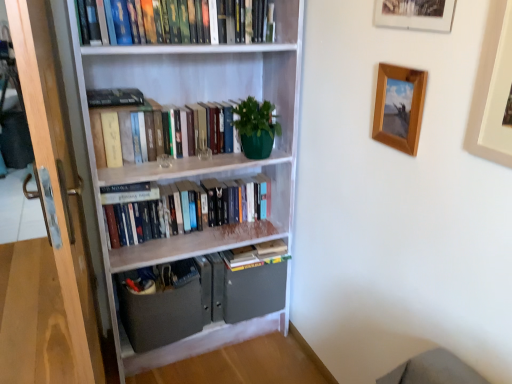
Question: Is matte gray cabinet at lower center thinner than hardcover books at upper center, the 4th book ordered from the bottom?

Choices:
 (A) no
 (B) yes

Answer: (A)

Question: Is matte gray cabinet at lower center far from hardcover books at upper center, the 4th book ordered from the bottom?

Choices:
 (A) no
 (B) yes

Answer: (B)

Question: Considering the relative sizes of matte gray cabinet at lower center and hardcover books at upper center, the 4th book ordered from the bottom, in the image provided, is matte gray cabinet at lower center wider than hardcover books at upper center, the 4th book ordered from the bottom,?

Choices:
 (A) no
 (B) yes

Answer: (B)

Question: From the image's perspective, is matte gray cabinet at lower center on top of hardcover books at upper center, the 4th book ordered from the bottom?

Choices:
 (A) yes
 (B) no

Answer: (B)

Question: From a real-world perspective, does matte gray cabinet at lower center sit lower than hardcover books at upper center, which is counted as the first book, starting from the top?

Choices:
 (A) no
 (B) yes

Answer: (B)

Question: Considering the positions of wooden picture frame at upper center, the 2th picture frame when ordered from left to right, and hardcover books at upper center, which is counted as the first book, starting from the top, in the image, is wooden picture frame at upper center, the 2th picture frame when ordered from left to right, taller or shorter than hardcover books at upper center, which is counted as the first book, starting from the top,?

Choices:
 (A) tall
 (B) short

Answer: (A)

Question: Relative to hardcover books at upper center, the 4th book ordered from the bottom, is wooden picture frame at upper center, the second picture frame viewed from the right, in front or behind?

Choices:
 (A) front
 (B) behind

Answer: (A)

Question: In terms of size, does wooden picture frame at upper center, the 2th picture frame when ordered from left to right, appear bigger or smaller than hardcover books at upper center, the 4th book ordered from the bottom?

Choices:
 (A) big
 (B) small

Answer: (B)

Question: Considering the positions of wooden picture frame at upper center, the 2th picture frame when ordered from left to right, and hardcover books at upper center, which is counted as the first book, starting from the top, in the image, is wooden picture frame at upper center, the 2th picture frame when ordered from left to right, wider or thinner than hardcover books at upper center, which is counted as the first book, starting from the top,?

Choices:
 (A) thin
 (B) wide

Answer: (A)

Question: Considering the relative positions of wooden picture frame at upper right, placed as the 1th picture frame when sorted from left to right, and wooden screen door at left in the image provided, is wooden picture frame at upper right, placed as the 1th picture frame when sorted from left to right, to the left or to the right of wooden screen door at left?

Choices:
 (A) left
 (B) right

Answer: (B)

Question: Is wooden picture frame at upper right, placed as the 1th picture frame when sorted from left to right, inside the boundaries of wooden screen door at left, or outside?

Choices:
 (A) outside
 (B) inside

Answer: (A)

Question: In terms of width, does wooden picture frame at upper right, arranged as the third picture frame when viewed from the right, look wider or thinner when compared to wooden screen door at left?

Choices:
 (A) wide
 (B) thin

Answer: (B)

Question: From the image's perspective, relative to wooden screen door at left, is wooden picture frame at upper right, arranged as the third picture frame when viewed from the right, above or below?

Choices:
 (A) below
 (B) above

Answer: (B)

Question: Considering the positions of wooden screen door at left and hardcover books at center, arranged as the 3th book when viewed from the top, in the image, is wooden screen door at left taller or shorter than hardcover books at center, arranged as the 3th book when viewed from the top,?

Choices:
 (A) short
 (B) tall

Answer: (B)

Question: Is wooden screen door at left bigger or smaller than hardcover books at center, arranged as the 3th book when viewed from the top?

Choices:
 (A) big
 (B) small

Answer: (A)